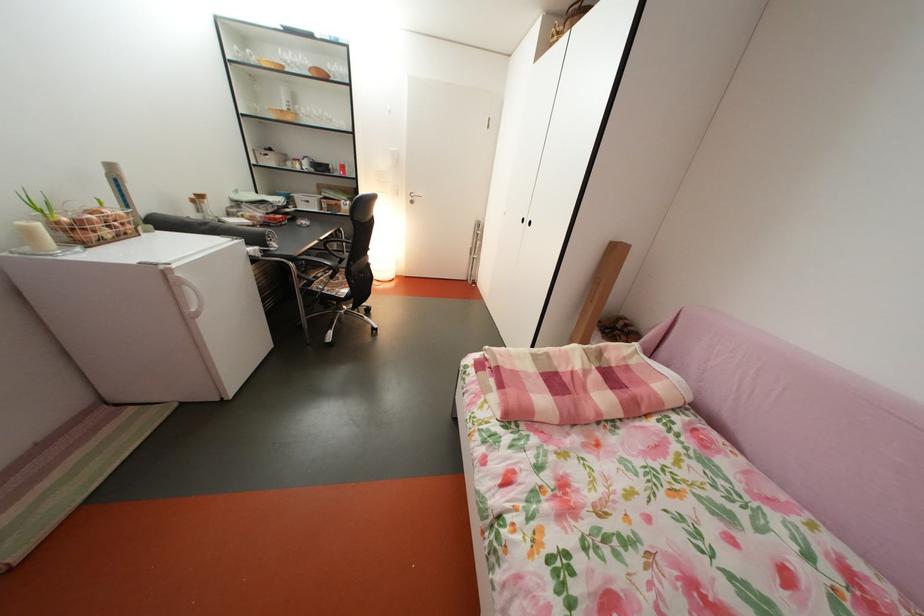
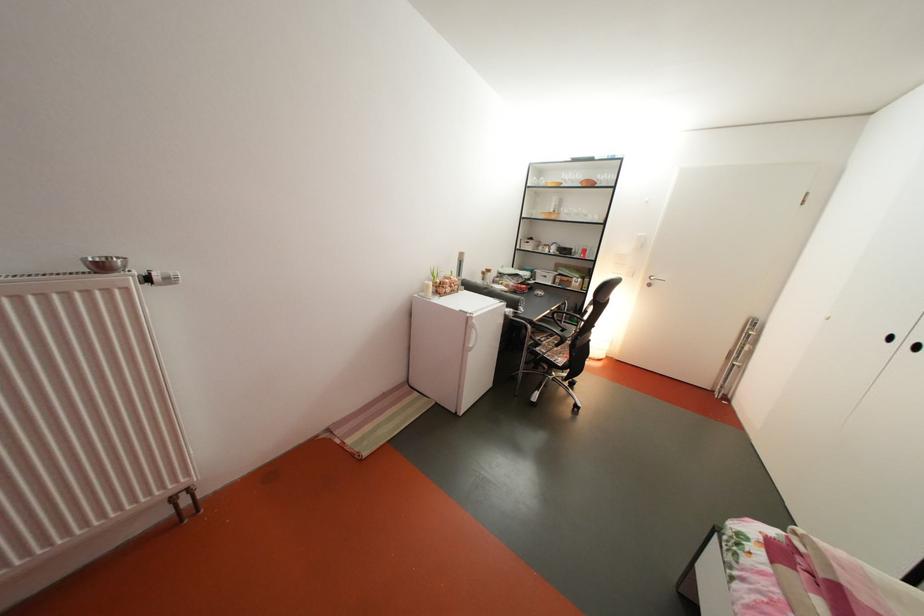
Question: Based on the continuous images, in which direction is the camera rotating? Reply with the corresponding letter.

Choices:
 (A) Left
 (B) Right
 (C) Up
 (D) Down

Answer: (A)